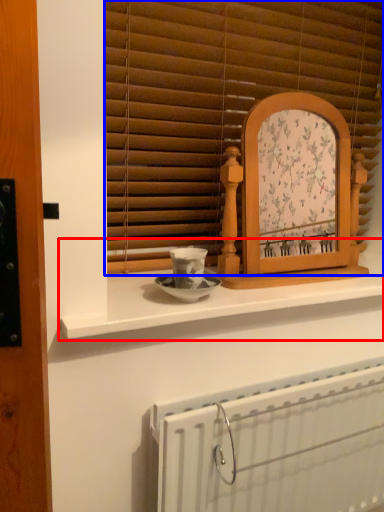
Question: Which object is closer to the camera taking this photo, counter (highlighted by a red box) or window blind (highlighted by a blue box)?

Choices:
 (A) counter
 (B) window blind

Answer: (A)